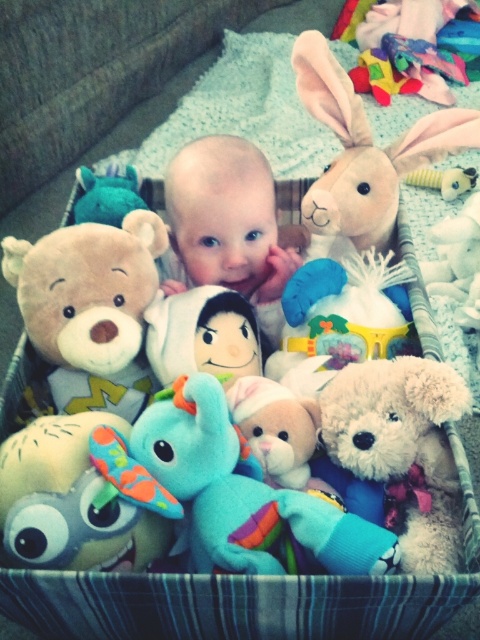
You are a parent trying to ensure the baby can easily reach all the toys in the basket. Given the baby is sitting in the center, which toy is closer to the baby, the soft plush toys at center or the multicolored fabric toy at upper right?

The soft plush toys at center are closer to the baby since they are positioned at the center where the baby is sitting, whereas the multicolored fabric toy at upper right is located further away at the upper right corner of the basket.

You are a photographer taking a picture of the baby and the toys in the basket. You need to focus on the two points in the image labeled as point [204,572] and point [350,452]. Which point should you focus on first to ensure both are in focus?

You should focus on point [204,572] first because it is closer to the camera than point [350,452], ensuring both points are within the depth of field.

Please look at the image and identify the object located at the coordinate point [243,492]. Which object is it?

The object at coordinate point [243,492] is the teal plush elephant at center.